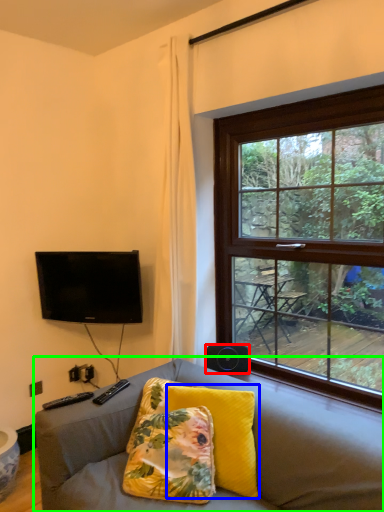
Question: Which object is the farthest from loudspeaker (highlighted by a red box)? Choose among these: pillow (highlighted by a blue box) or studio couch (highlighted by a green box).

Choices:
 (A) pillow
 (B) studio couch

Answer: (B)